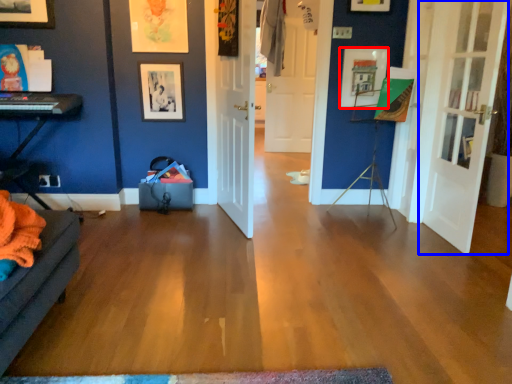
Question: Which point is further to the camera, picture frame (highlighted by a red box) or door (highlighted by a blue box)?

Choices:
 (A) picture frame
 (B) door

Answer: (A)